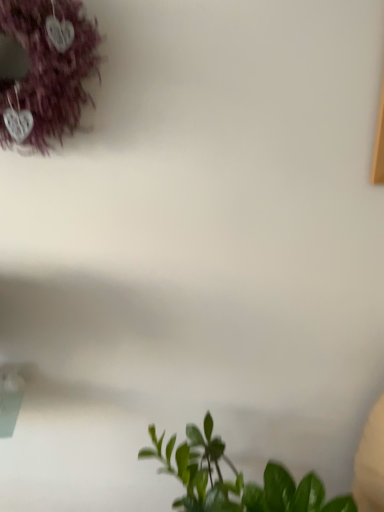
This screenshot has height=512, width=384. I want to click on purple matte wreath at upper left, so click(x=48, y=68).

Describe the element at coordinates (48, 68) in the screenshot. I see `purple matte wreath at upper left` at that location.

This screenshot has height=512, width=384. In order to click on purple matte wreath at upper left in this screenshot , I will do [48, 68].